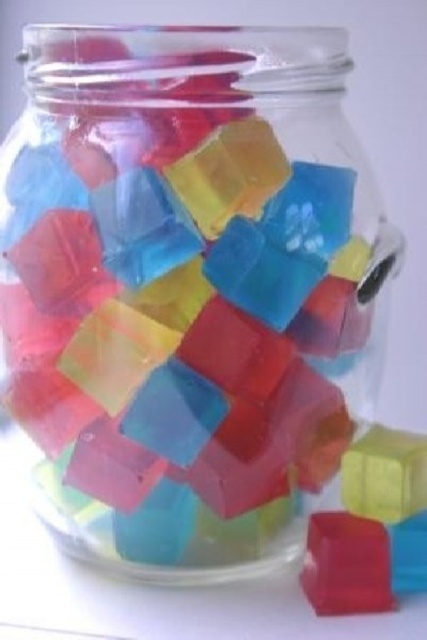
I want to click on translucent plastic cube at center, so click(371, 528).

Can you confirm if translucent plastic cube at center is wider than translucent rubber cube at lower right?

Yes, translucent plastic cube at center is wider than translucent rubber cube at lower right.

Find the location of a particular element. translucent plastic cube at center is located at coordinates tap(371, 528).